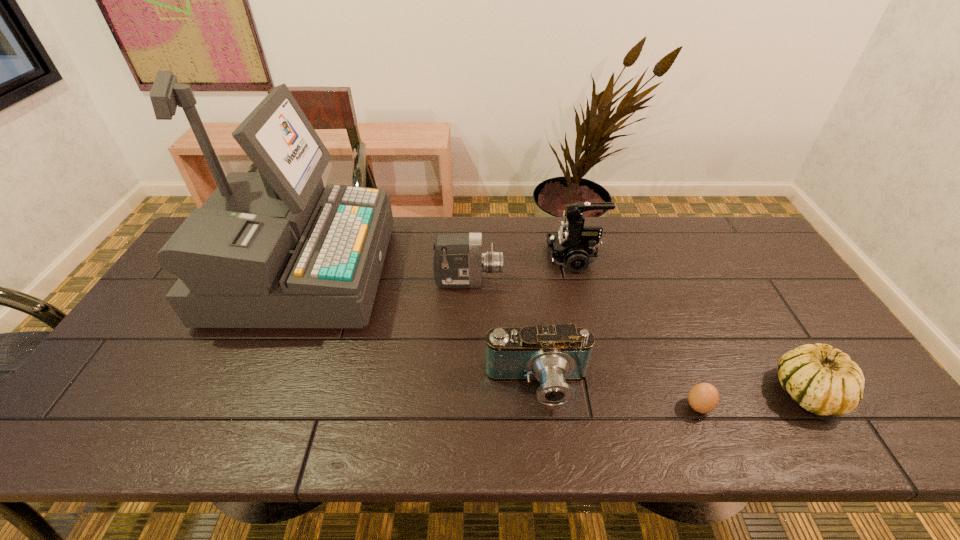
Locate an element on the screen. The image size is (960, 540). vacant space located on the lens mount of the tallest camcorder is located at coordinates (x=464, y=258).

The image size is (960, 540). Identify the location of vacant region located 0.300m on the left of the rightmost object. (647, 392).

Image resolution: width=960 pixels, height=540 pixels. In order to click on free space located 0.390m on the left of the shortest object in this screenshot , I will do `click(517, 407)`.

This screenshot has width=960, height=540. Find the location of `cash register situated at the far edge`. cash register situated at the far edge is located at coordinates (271, 249).

At what (x,y) coordinates should I click in order to perform the action: click on camcorder positioned at the far edge. Please return your answer as a coordinate pair (x, y). This screenshot has width=960, height=540. Looking at the image, I should click on (574, 246).

Where is `camcorder positioned at the near edge`? The width and height of the screenshot is (960, 540). camcorder positioned at the near edge is located at coordinates (553, 354).

Where is `gourd that is positioned at the near edge`? This screenshot has width=960, height=540. gourd that is positioned at the near edge is located at coordinates (823, 380).

The width and height of the screenshot is (960, 540). I want to click on boiled egg that is at the near edge, so click(x=704, y=397).

I want to click on object located in the left edge section of the desktop, so click(271, 249).

You are a GUI agent. You are given a task and a screenshot of the screen. Output one action in this format:
    pyautogui.click(x=<x>, y=<y>)
    Task: Click on the object that is at the right edge
    The image size is (960, 540).
    Given the screenshot: What is the action you would take?
    pyautogui.click(x=823, y=380)